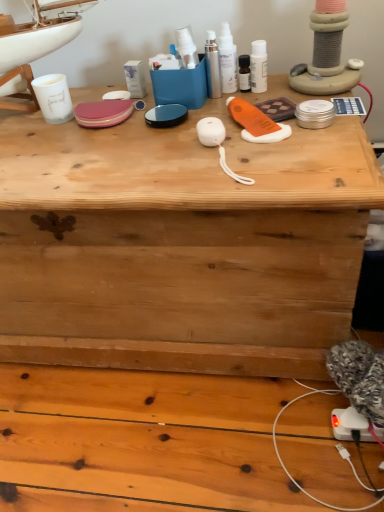
Locate an element on the screen. vacant region to the left of white glossy lotion at upper center, positioned as the first toiletry in right-to-left order is located at coordinates (178, 114).